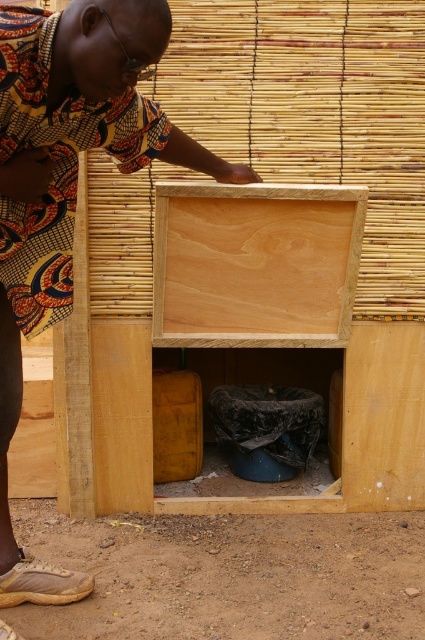
You are a delivery person who needs to place a package between the printed fabric shirt at center and the natural wood crate at center. The package requires 18 inches of space. Is there enough space between them?

The printed fabric shirt at center is 20.40 inches away from the natural wood crate at center, so yes, there is enough space to place the package between them since 20.40 inches is greater than the required 18 inches.

You are organizing items in the storage area and need to place the printed fabric shirt at center and the natural wood crate at center. According to the scene, which object is positioned to the left of the other?

The printed fabric shirt at center is to the left of the natural wood crate at center.